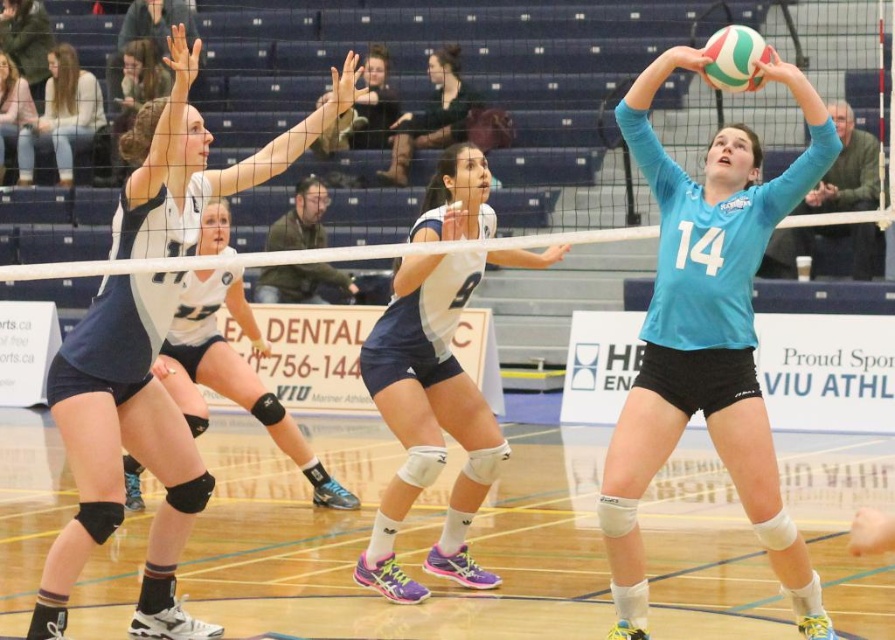
Question: Does wooden floor at center have a larger size compared to blue jersey at center?

Choices:
 (A) no
 (B) yes

Answer: (B)

Question: Estimate the real-world distances between objects in this image. Which object is farther from the teal matte volleyball at center?

Choices:
 (A) white matte volleyball at center
 (B) blue jersey at center

Answer: (B)

Question: Which object is farther from the camera taking this photo?

Choices:
 (A) matte white jersey at center
 (B) wooden floor at center
 (C) matte white jersey at upper left

Answer: (C)

Question: Does white matte knee pads at center have a greater width compared to multicolored rubber volleyball at upper right?

Choices:
 (A) no
 (B) yes

Answer: (B)

Question: Based on their relative distances, which object is farther from the matte white jersey at center?

Choices:
 (A) white matte volleyball at center
 (B) blue jersey at center
 (C) multicolored rubber volleyball at upper right

Answer: (B)

Question: Is white matte volleyball at center thinner than matte white tank top at upper left?

Choices:
 (A) no
 (B) yes

Answer: (A)